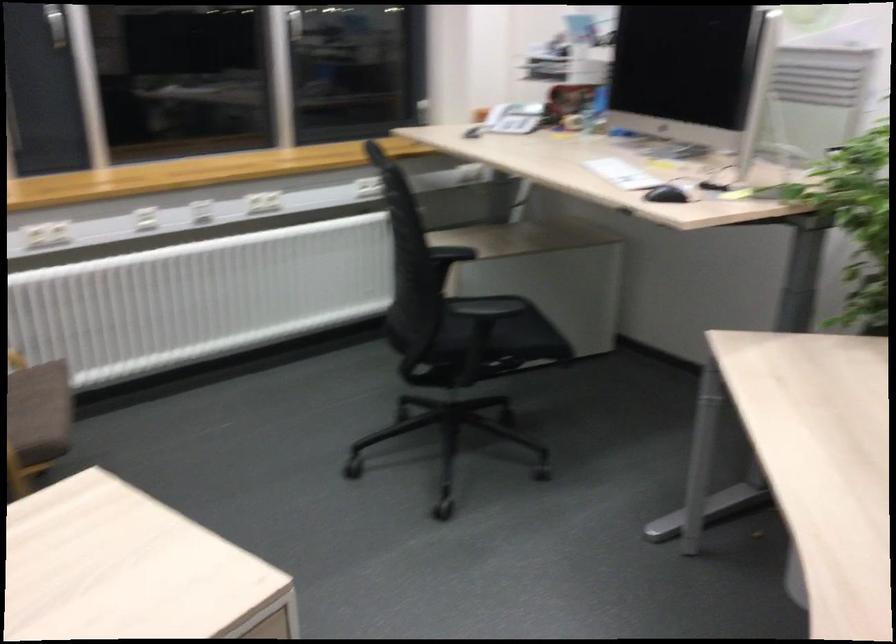
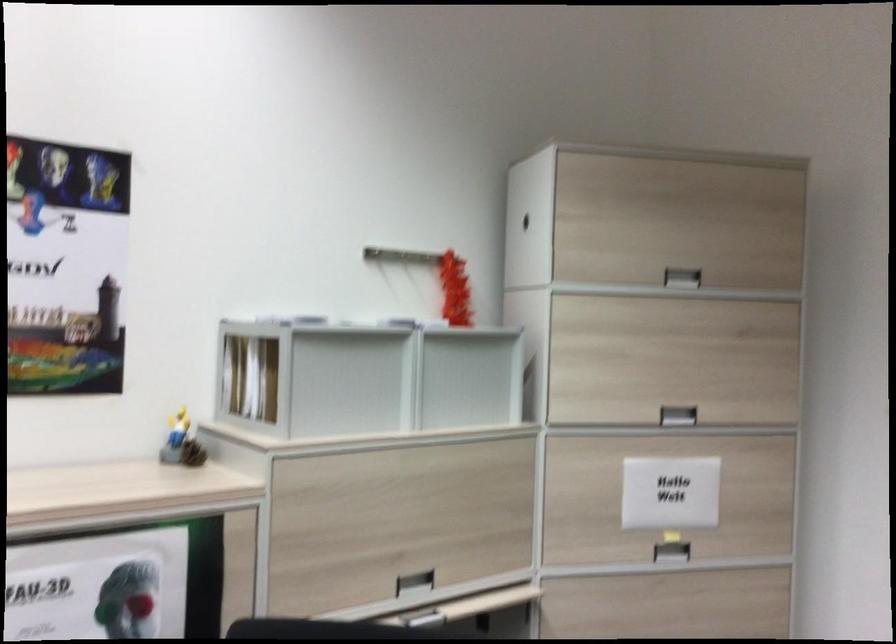
Question: The first image is from the beginning of the video and the second image is from the end. How did the camera likely rotate when shooting the video?

Choices:
 (A) Left
 (B) Right
 (C) Up
 (D) Down

Answer: (B)